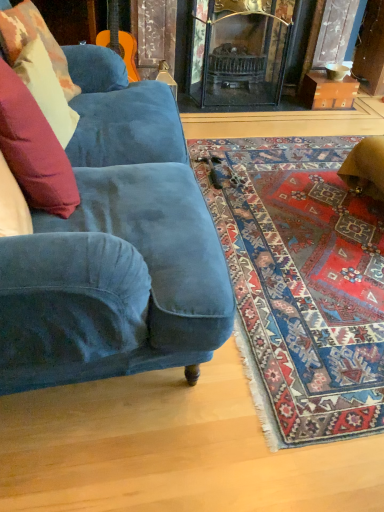
Question: Is carpet with intricate patterns at lower right positioned before velvet cushion at left, the second pillow in the front-to-back sequence?

Choices:
 (A) no
 (B) yes

Answer: (B)

Question: Is carpet with intricate patterns at lower right turned away from velvet cushion at left, which appears as the 2th pillow when viewed from the back?

Choices:
 (A) yes
 (B) no

Answer: (B)

Question: Is carpet with intricate patterns at lower right completely or partially outside of velvet cushion at left, which appears as the 2th pillow when viewed from the back?

Choices:
 (A) yes
 (B) no

Answer: (A)

Question: Does carpet with intricate patterns at lower right have a lesser height compared to velvet cushion at left, the second pillow in the front-to-back sequence?

Choices:
 (A) no
 (B) yes

Answer: (B)

Question: Does carpet with intricate patterns at lower right have a lesser width compared to velvet cushion at left, which appears as the 2th pillow when viewed from the back?

Choices:
 (A) no
 (B) yes

Answer: (A)

Question: Is carpet with intricate patterns at lower right taller than velvet cushion at left, which appears as the 2th pillow when viewed from the back?

Choices:
 (A) no
 (B) yes

Answer: (A)

Question: Considering the relative sizes of velvet cushion at left, placed as the first pillow when sorted from back to front, and velvet blue couch at lower left in the image provided, is velvet cushion at left, placed as the first pillow when sorted from back to front, taller than velvet blue couch at lower left?

Choices:
 (A) no
 (B) yes

Answer: (A)

Question: Is velvet cushion at left, placed as the first pillow when sorted from back to front, oriented away from velvet blue couch at lower left?

Choices:
 (A) no
 (B) yes

Answer: (B)

Question: Is velvet cushion at left, the 3th pillow viewed from the front, aimed at velvet blue couch at lower left?

Choices:
 (A) no
 (B) yes

Answer: (B)

Question: Is velvet cushion at left, placed as the first pillow when sorted from back to front, to the left of velvet blue couch at lower left from the viewer's perspective?

Choices:
 (A) yes
 (B) no

Answer: (A)

Question: Is velvet cushion at left, placed as the first pillow when sorted from back to front, positioned beyond the bounds of velvet blue couch at lower left?

Choices:
 (A) no
 (B) yes

Answer: (A)

Question: Does velvet cushion at left, the 3th pillow viewed from the front, come in front of velvet blue couch at lower left?

Choices:
 (A) yes
 (B) no

Answer: (B)

Question: Does velvet cushion at left, which is the 1th pillow in front-to-back order, have a smaller size compared to velvet cushion at left, the second pillow in the front-to-back sequence?

Choices:
 (A) yes
 (B) no

Answer: (B)